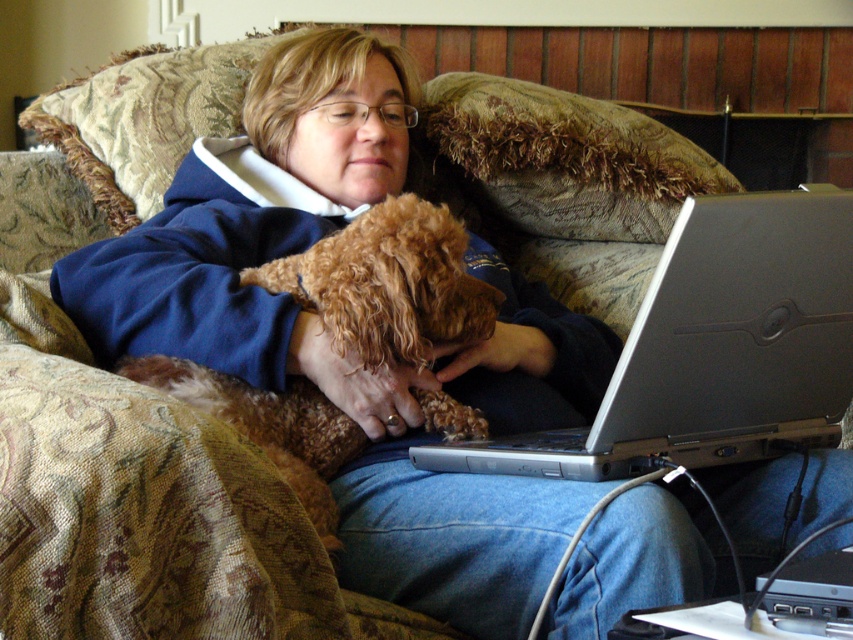
Does silver metallic laptop at lower right appear on the right side of brown curly fur dog at center?

Indeed, silver metallic laptop at lower right is positioned on the right side of brown curly fur dog at center.

Is silver metallic laptop at lower right smaller than brown curly fur dog at center?

No, silver metallic laptop at lower right is not smaller than brown curly fur dog at center.

Is point (730, 196) positioned before point (347, 314)?

Yes, it is in front of point (347, 314).

This screenshot has width=853, height=640. I want to click on silver metallic laptop at lower right, so click(x=712, y=348).